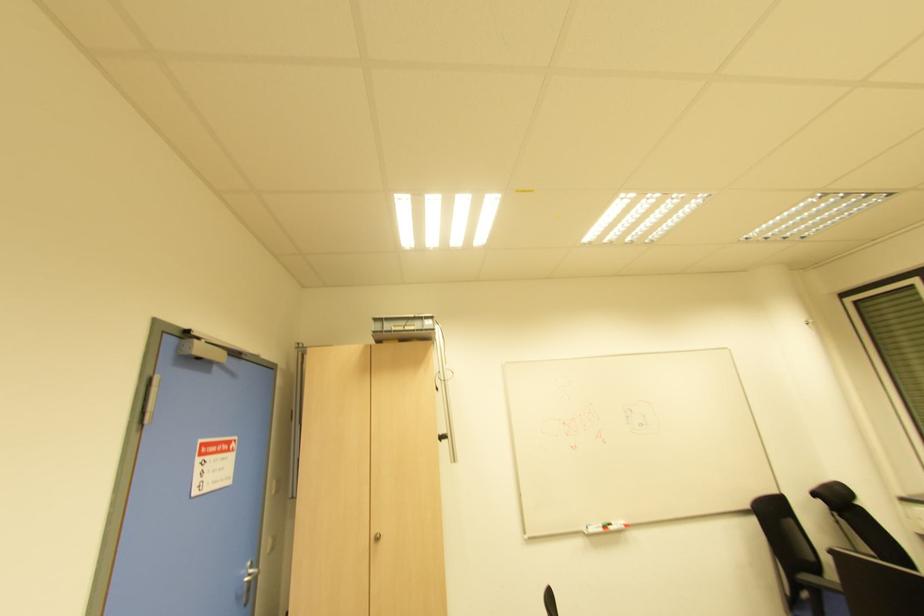
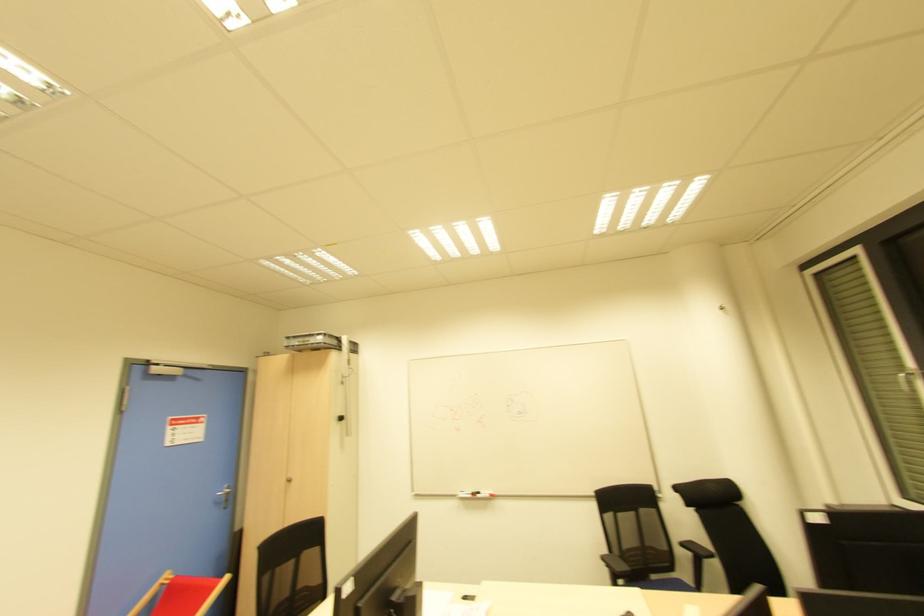
Find the pixel in the second image that matches point (626, 525) in the first image.

(492, 496)